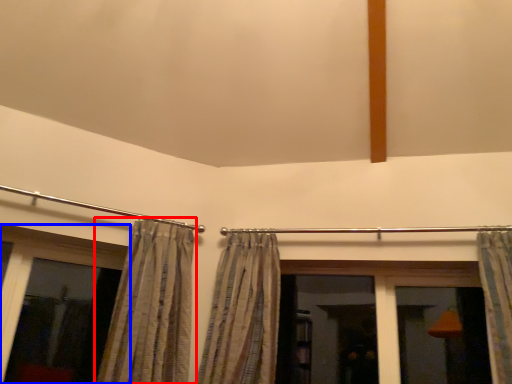
Question: Which object is further to the camera taking this photo, curtain (highlighted by a red box) or window (highlighted by a blue box)?

Choices:
 (A) curtain
 (B) window

Answer: (B)